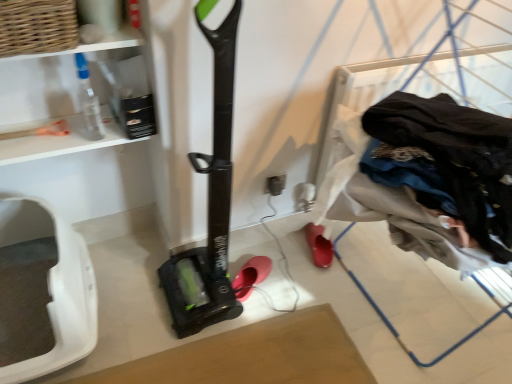
Question: Should I look upward or downward to see rubberized red shoe at lower center, acting as the 1th footwear starting from the right?

Choices:
 (A) down
 (B) up

Answer: (A)

Question: Is white plastic pet carrier at lower left placed right next to matte gray electric outlet at center?

Choices:
 (A) yes
 (B) no

Answer: (B)

Question: Can you confirm if white plastic pet carrier at lower left is thinner than matte gray electric outlet at center?

Choices:
 (A) no
 (B) yes

Answer: (A)

Question: Is white plastic pet carrier at lower left turned away from matte gray electric outlet at center?

Choices:
 (A) no
 (B) yes

Answer: (A)

Question: Are white plastic pet carrier at lower left and matte gray electric outlet at center located far from each other?

Choices:
 (A) no
 (B) yes

Answer: (A)

Question: Can you confirm if white plastic pet carrier at lower left is smaller than matte gray electric outlet at center?

Choices:
 (A) yes
 (B) no

Answer: (B)

Question: Does white plastic pet carrier at lower left have a larger size compared to matte gray electric outlet at center?

Choices:
 (A) yes
 (B) no

Answer: (A)

Question: Is woven brown basket at upper left further to camera compared to pink matte shoe at center, the first footwear when ordered from left to right?

Choices:
 (A) yes
 (B) no

Answer: (B)

Question: Is pink matte shoe at center, placed as the 2th footwear when sorted from right to left, inside woven brown basket at upper left?

Choices:
 (A) yes
 (B) no

Answer: (B)

Question: Is woven brown basket at upper left closer to the viewer compared to pink matte shoe at center, the first footwear when ordered from left to right?

Choices:
 (A) yes
 (B) no

Answer: (A)

Question: Is woven brown basket at upper left shorter than pink matte shoe at center, the first footwear when ordered from left to right?

Choices:
 (A) yes
 (B) no

Answer: (B)

Question: From a real-world perspective, is woven brown basket at upper left on pink matte shoe at center, placed as the 2th footwear when sorted from right to left?

Choices:
 (A) no
 (B) yes

Answer: (B)

Question: Is woven brown basket at upper left next to pink matte shoe at center, the first footwear when ordered from left to right?

Choices:
 (A) yes
 (B) no

Answer: (B)

Question: Are woven brown basket at upper left and matte gray electric outlet at center beside each other?

Choices:
 (A) no
 (B) yes

Answer: (A)